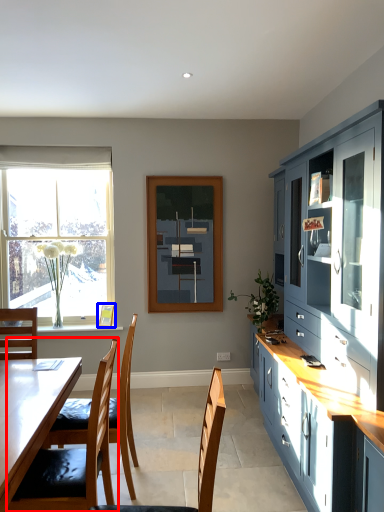
Question: Among these objects, which one is farthest to the camera, chair (highlighted by a red box) or picture frame (highlighted by a blue box)?

Choices:
 (A) chair
 (B) picture frame

Answer: (B)